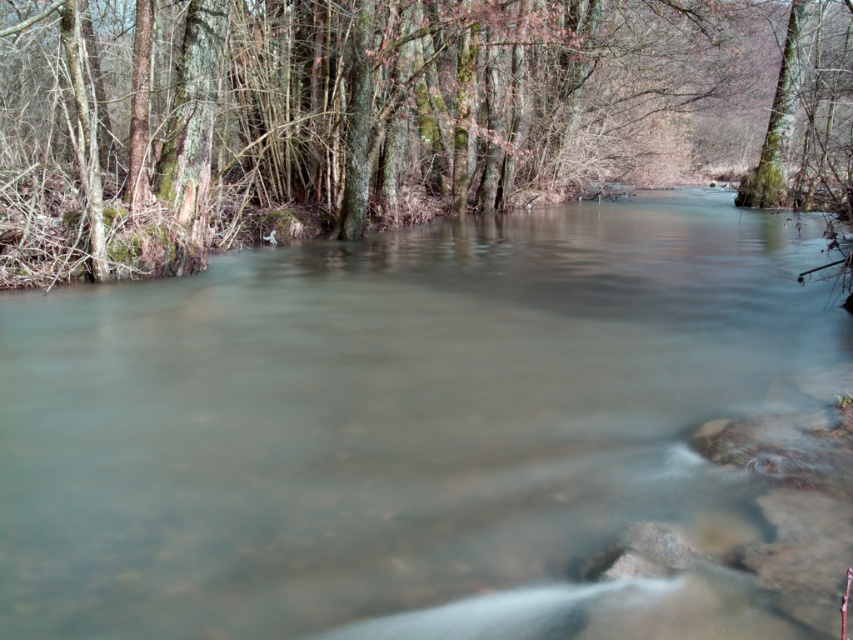
Between clear water at center and green mossy tree at upper left, which one has more height?

Standing taller between the two is green mossy tree at upper left.

Can you confirm if clear water at center is positioned above green mossy tree at upper left?

Actually, clear water at center is below green mossy tree at upper left.

Who is more distant from viewer, (141,468) or (372,45)?

The point (372,45) is more distant.

I want to click on clear water at center, so click(x=405, y=426).